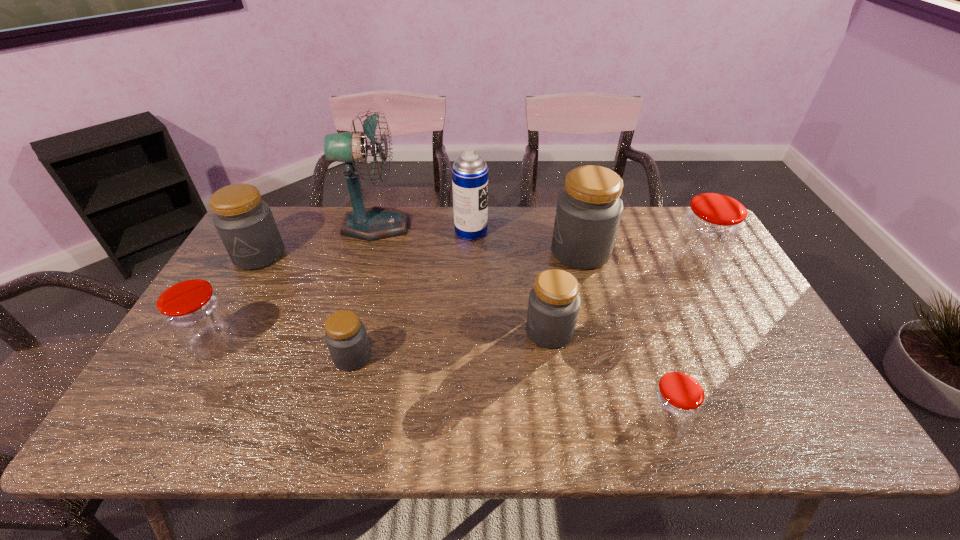
Identify the location of free space located 0.270m on the surface of the second biggest gray jar near the warning symbol. (210, 342).

At what (x,y) coordinates should I click in order to perform the action: click on vacant space located 0.180m on the front of the rightmost object. Please return your answer as a coordinate pair (x, y). The width and height of the screenshot is (960, 540). Looking at the image, I should click on (728, 332).

At what (x,y) coordinates should I click in order to perform the action: click on free space located 0.310m on the surface of the second smallest gray jar near the warning symbol. Please return your answer as a coordinate pair (x, y). This screenshot has height=540, width=960. Looking at the image, I should click on (408, 332).

I want to click on vacant space situated on the surface of the second smallest gray jar near the warning symbol, so click(x=422, y=332).

Find the location of `blank space located on the surface of the second smallest gray jar near the warning symbol`. blank space located on the surface of the second smallest gray jar near the warning symbol is located at coordinates (422, 332).

In order to click on vacant position located on the right of the second biggest red jar in this screenshot , I will do (321, 344).

Where is `vacant space situated 0.190m on the surface of the second gray jar from left to right near the warning symbol`? The height and width of the screenshot is (540, 960). vacant space situated 0.190m on the surface of the second gray jar from left to right near the warning symbol is located at coordinates (447, 357).

The image size is (960, 540). Find the location of `vacant space located on the right of the nearest red jar`. vacant space located on the right of the nearest red jar is located at coordinates (785, 423).

Where is `fan located in the far edge section of the desktop`? This screenshot has width=960, height=540. fan located in the far edge section of the desktop is located at coordinates pyautogui.click(x=374, y=223).

This screenshot has height=540, width=960. Find the location of `aerosol can that is positioned at the far edge`. aerosol can that is positioned at the far edge is located at coordinates (469, 172).